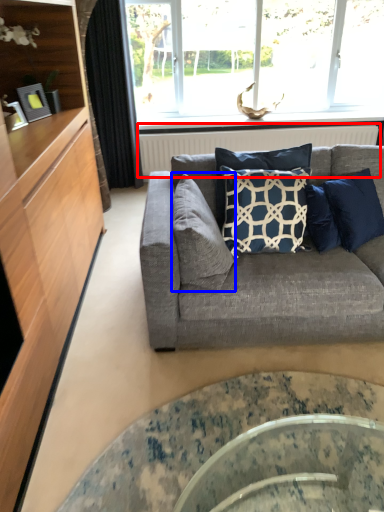
Question: Among these objects, which one is farthest to the camera, radiator (highlighted by a red box) or pillow (highlighted by a blue box)?

Choices:
 (A) radiator
 (B) pillow

Answer: (A)